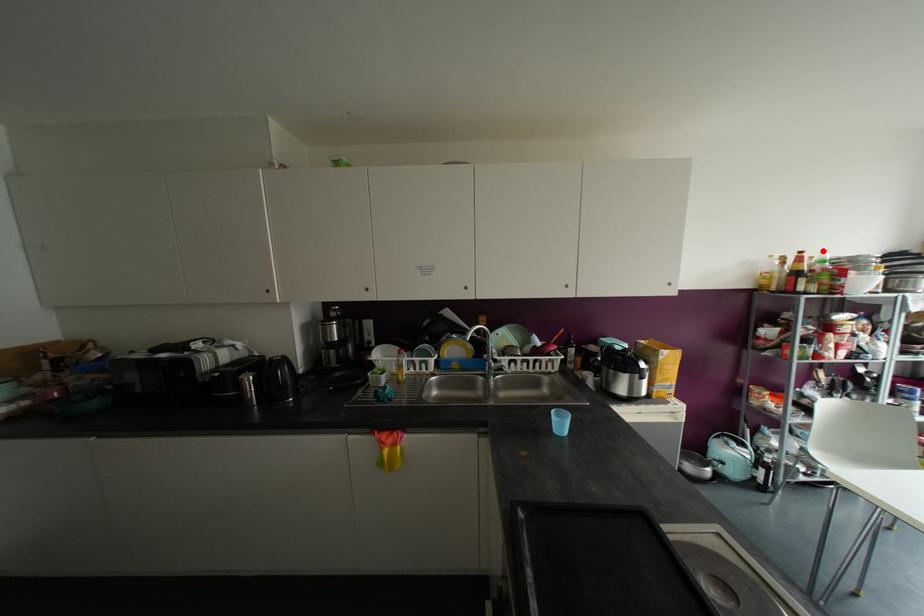
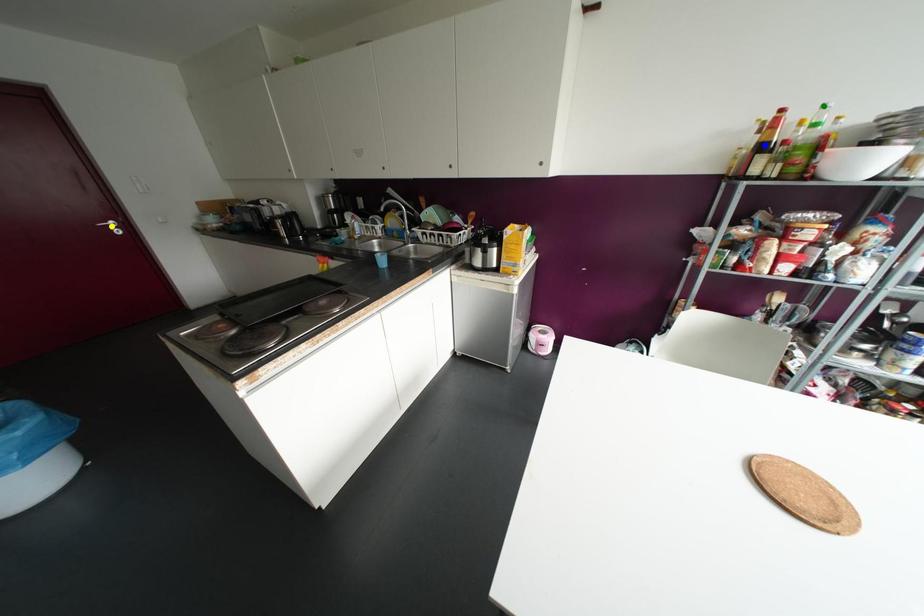
Question: I am providing you with two images of the same scene from different viewpoints. A red point is marked on the first image. You are given multiple points on the second image. Which mark in image 2 goes with the point in image 1?

Choices:
 (A) green point
 (B) yellow point
 (C) blue point

Answer: (A)